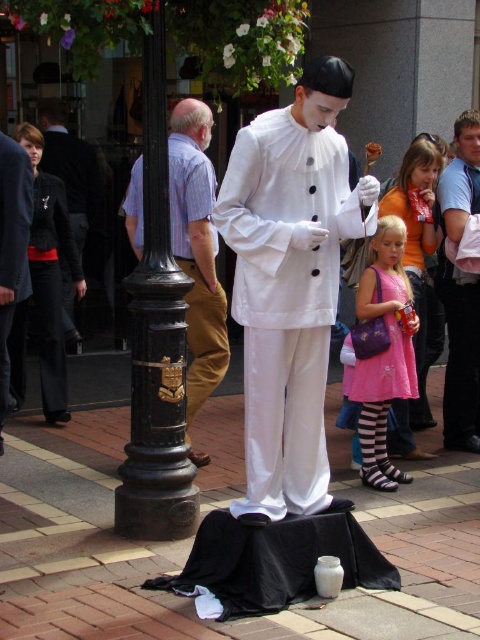
Question: In this image, where is pink fabric dress at right located relative to dark blue suit at left?

Choices:
 (A) left
 (B) right

Answer: (B)

Question: Considering the relative positions of white matte/soft clown at center and pink fabric dress at right in the image provided, where is white matte/soft clown at center located with respect to pink fabric dress at right?

Choices:
 (A) above
 (B) below

Answer: (B)

Question: Which of the following is the closest to the observer?

Choices:
 (A) black leather jacket at left
 (B) black fabric at center
 (C) light brown corduroy pants at center
 (D) white matte/soft clown at center

Answer: (B)

Question: Which point is farther to the camera?

Choices:
 (A) click(2, 212)
 (B) click(382, 388)

Answer: (B)

Question: Does white matte/soft clown at center have a smaller size compared to black matte cloth at lower center?

Choices:
 (A) yes
 (B) no

Answer: (B)

Question: Which object is closer to the camera taking this photo?

Choices:
 (A) dark blue suit at left
 (B) black leather jacket at left
 (C) black matte cloth at lower center
 (D) pink satin dress at lower right

Answer: (C)